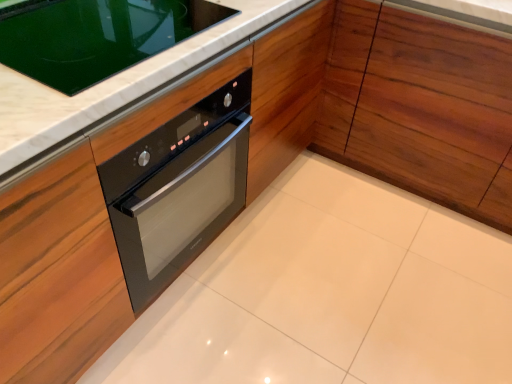
What do you see at coordinates (95, 36) in the screenshot? I see `black glass oven at upper left` at bounding box center [95, 36].

The height and width of the screenshot is (384, 512). What are the coordinates of `black glass oven at upper left` in the screenshot? It's located at (x=95, y=36).

The image size is (512, 384). Describe the element at coordinates (421, 107) in the screenshot. I see `wooden cabinet at center` at that location.

I want to click on wooden cabinet at center, so click(421, 107).

Measure the distance between wooden cabinet at center and camera.

The distance of wooden cabinet at center from camera is 4.51 feet.

You are a GUI agent. You are given a task and a screenshot of the screen. Output one action in this format:
    pyautogui.click(x=<x>, y=<y>)
    Task: Click on the black glass oven at upper left
    
    Given the screenshot: What is the action you would take?
    pyautogui.click(x=95, y=36)

Between black glass oven at upper left and wooden cabinet at center, which one appears on the right side from the viewer's perspective?

From the viewer's perspective, wooden cabinet at center appears more on the right side.

Is black glass oven at upper left closer to the viewer compared to wooden cabinet at center?

Yes, black glass oven at upper left is closer to the camera.

Which is closer to the camera, (67, 79) or (509, 204)?

The point (67, 79) is more forward.

From the image's perspective, which object appears higher, black glass oven at upper left or wooden cabinet at center?

wooden cabinet at center appears higher in the image.

From a real-world perspective, between black glass oven at upper left and wooden cabinet at center, who is vertically higher?

black glass oven at upper left is physically above.

Between black glass oven at upper left and wooden cabinet at center, which one has smaller width?

With smaller width is black glass oven at upper left.

Can you confirm if black glass oven at upper left is shorter than wooden cabinet at center?

Yes, black glass oven at upper left is shorter than wooden cabinet at center.

Which of these two, black glass oven at upper left or wooden cabinet at center, is bigger?

With larger size is wooden cabinet at center.

Is black glass oven at upper left positioned beyond the bounds of wooden cabinet at center?

Yes, black glass oven at upper left is outside of wooden cabinet at center.

Are black glass oven at upper left and wooden cabinet at center beside each other?

No, black glass oven at upper left is not next to wooden cabinet at center.

Is black glass oven at upper left facing towards wooden cabinet at center?

No, black glass oven at upper left is not oriented towards wooden cabinet at center.

At what (x,y) coordinates should I click in order to perform the action: click on cabinetry below the black glass oven at upper left (from a real-world perspective). Please return your answer as a coordinate pair (x, y). Image resolution: width=512 pixels, height=384 pixels. Looking at the image, I should click on (421, 107).

Between wooden cabinet at center and black glass oven at upper left, which one appears on the right side from the viewer's perspective?

Positioned to the right is wooden cabinet at center.

Between wooden cabinet at center and black glass oven at upper left, which one is positioned in front?

Positioned in front is black glass oven at upper left.

Is point (437, 99) closer or farther from the camera than point (89, 24)?

Point (437, 99) appears to be farther away from the viewer than point (89, 24).

From the image's perspective, is wooden cabinet at center above or below black glass oven at upper left?

wooden cabinet at center is situated higher than black glass oven at upper left in the image.

From a real-world perspective, is wooden cabinet at center positioned under black glass oven at upper left based on gravity?

Yes, from a real-world perspective, wooden cabinet at center is under black glass oven at upper left.

Considering the relative sizes of wooden cabinet at center and black glass oven at upper left in the image provided, is wooden cabinet at center thinner than black glass oven at upper left?

No, wooden cabinet at center is not thinner than black glass oven at upper left.

From their relative heights in the image, would you say wooden cabinet at center is taller or shorter than black glass oven at upper left?

wooden cabinet at center is taller than black glass oven at upper left.

Can you confirm if wooden cabinet at center is bigger than black glass oven at upper left?

Correct, wooden cabinet at center is larger in size than black glass oven at upper left.

Choose the correct answer: Is wooden cabinet at center inside black glass oven at upper left or outside it?

Result: wooden cabinet at center is outside black glass oven at upper left.

Is wooden cabinet at center touching black glass oven at upper left?

No, wooden cabinet at center is not in contact with black glass oven at upper left.

Is wooden cabinet at center oriented away from black glass oven at upper left?

wooden cabinet at center does not have its back to black glass oven at upper left.

The height and width of the screenshot is (384, 512). In order to click on cabinetry lying behind the black glass oven at upper left in this screenshot , I will do `click(421, 107)`.

Locate an element on the screen. The height and width of the screenshot is (384, 512). home appliance in front of the wooden cabinet at center is located at coordinates (95, 36).

You are a GUI agent. You are given a task and a screenshot of the screen. Output one action in this format:
    pyautogui.click(x=<x>, y=<y>)
    Task: Click on the home appliance lying on the left of wooden cabinet at center
    The height and width of the screenshot is (384, 512).
    Given the screenshot: What is the action you would take?
    pyautogui.click(x=95, y=36)